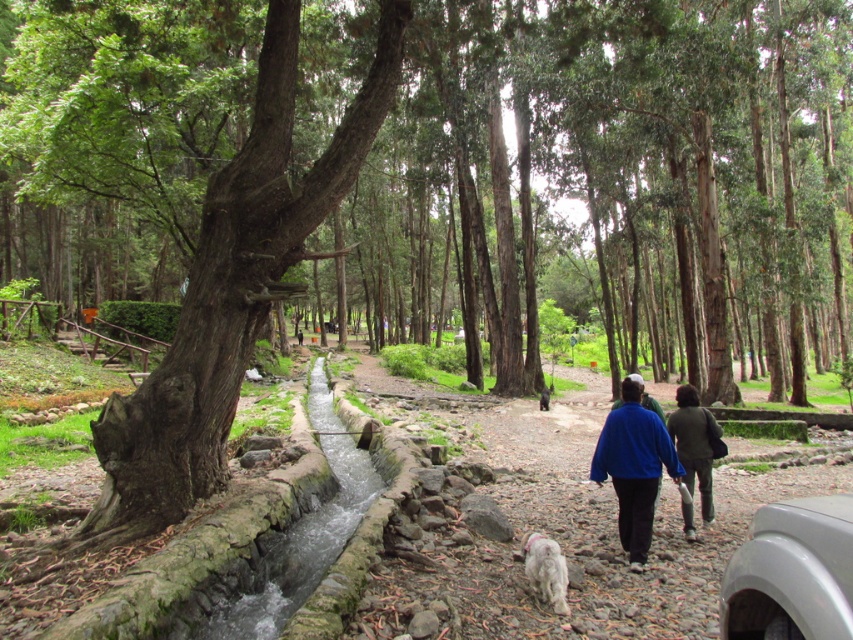
You are standing in the forest and see the green rough bark tree at center and the white fluffy dog at center. Which object is positioned higher in the scene?

The green rough bark tree at center is located above the white fluffy dog at center, so it is positioned higher in the scene.

You are standing in the forest and see the gray matte car at lower right and the blue fleece jacket at center. Which object is nearer to you?

The gray matte car at lower right is closer to the viewer than the blue fleece jacket at center.